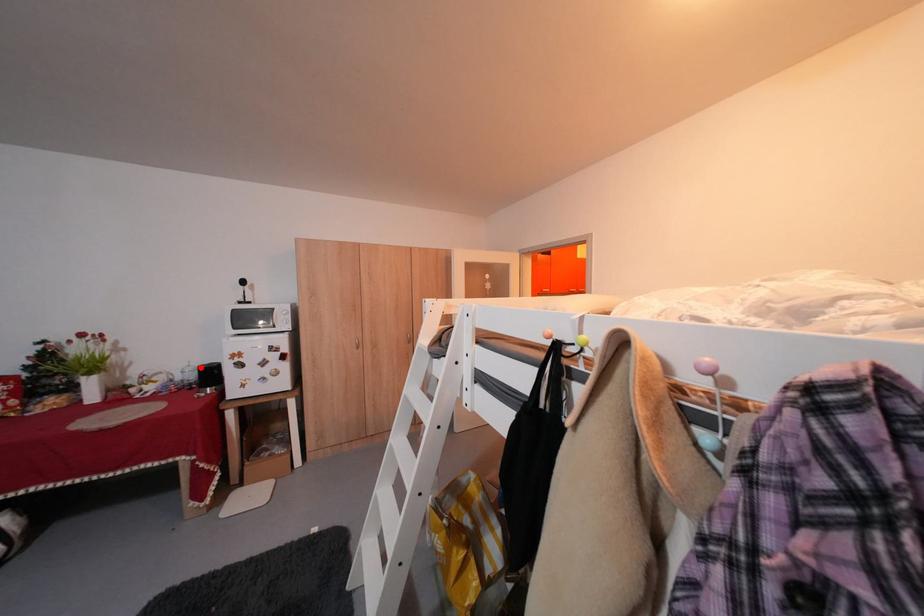
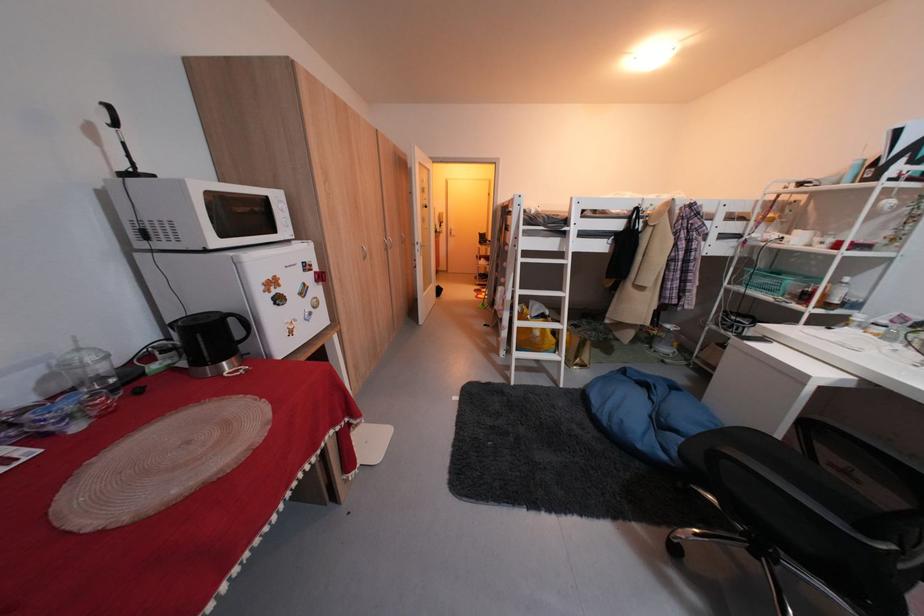
Question: I am providing you with two images of the same scene from different viewpoints. Given a red point in image1, look at the same physical point in image2. Is it:

Choices:
 (A) Closer to the viewpoint
 (B) Farther from the viewpoint

Answer: (A)